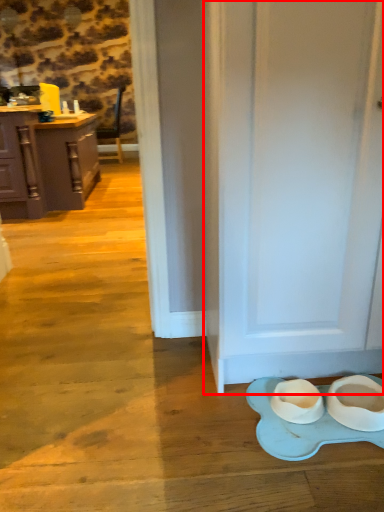
Question: From the image's perspective, what is the correct spatial positioning of door (annotated by the red box) in reference to cabinetry?

Choices:
 (A) above
 (B) below

Answer: (B)